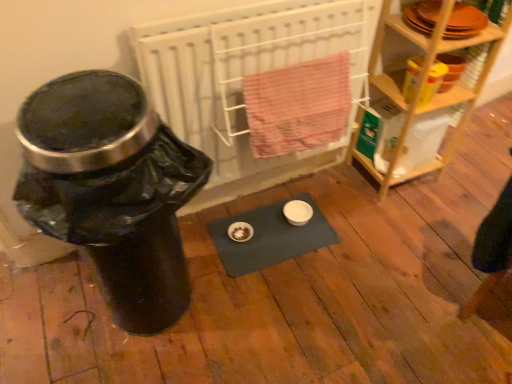
Locate an element on the screen. free space that is in between wooden shelf at right and blue fabric yoga mat at center is located at coordinates (336, 196).